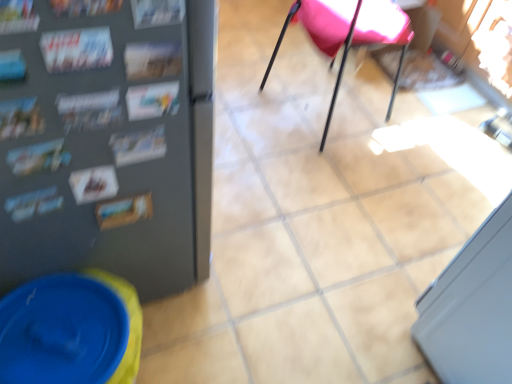
Locate an element on the screen. This screenshot has height=384, width=512. vacant space situated on the left part of pink fabric chair at center is located at coordinates coord(245,94).